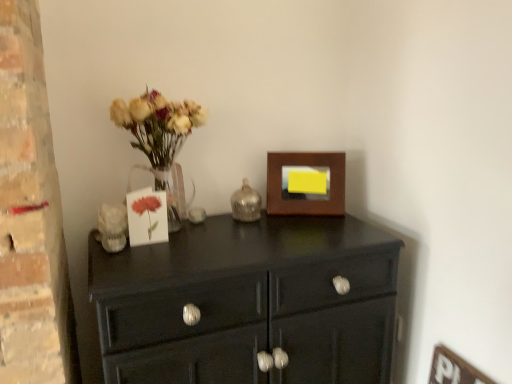
Where is `vacant space that's between matte glass vase with dried flowers at left and wooden picture frame at upper right`? vacant space that's between matte glass vase with dried flowers at left and wooden picture frame at upper right is located at coordinates (259, 224).